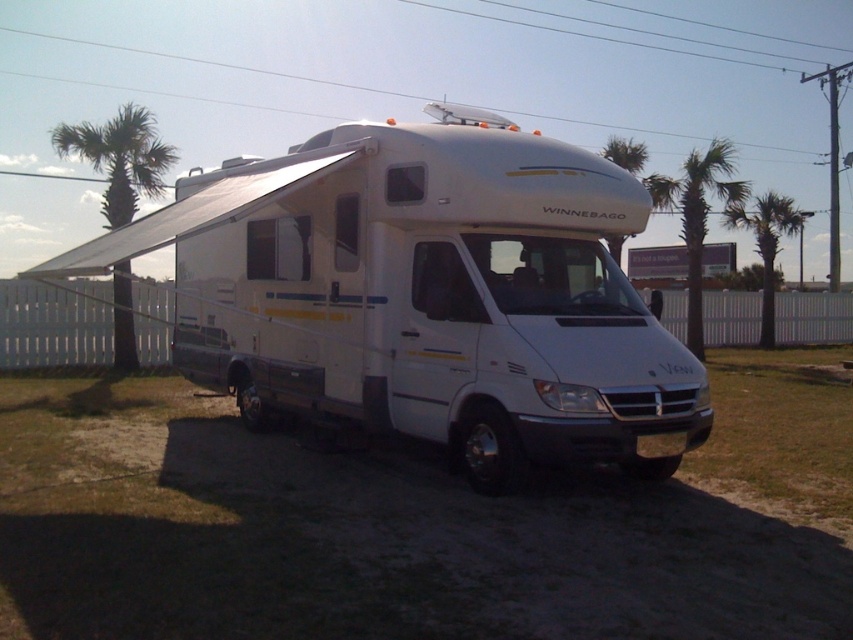
Describe the element at coordinates (120, 157) in the screenshot. I see `green leafy palm tree at left` at that location.

Between green leafy palm tree at left and green leafy palm tree at right, which one appears on the left side from the viewer's perspective?

green leafy palm tree at left

Between point (149, 147) and point (752, 209), which one is positioned behind?

The point (752, 209) is behind.

Identify the location of green leafy palm tree at left. This screenshot has height=640, width=853. (120, 157).

Who is lower down, white matte recreational vehicle at center or green leafy palm tree at upper center?

green leafy palm tree at upper center

What do you see at coordinates (425, 296) in the screenshot? The width and height of the screenshot is (853, 640). I see `white matte recreational vehicle at center` at bounding box center [425, 296].

Find the location of a particular element. This screenshot has width=853, height=640. white matte recreational vehicle at center is located at coordinates (425, 296).

The width and height of the screenshot is (853, 640). Identify the location of white matte recreational vehicle at center. (425, 296).

Does point (552, 282) come closer to viewer compared to point (138, 124)?

That is True.

You are a GUI agent. You are given a task and a screenshot of the screen. Output one action in this format:
    pyautogui.click(x=<x>, y=<y>)
    Task: Click on the white matte recreational vehicle at center
    The width and height of the screenshot is (853, 640).
    Given the screenshot: What is the action you would take?
    pyautogui.click(x=425, y=296)